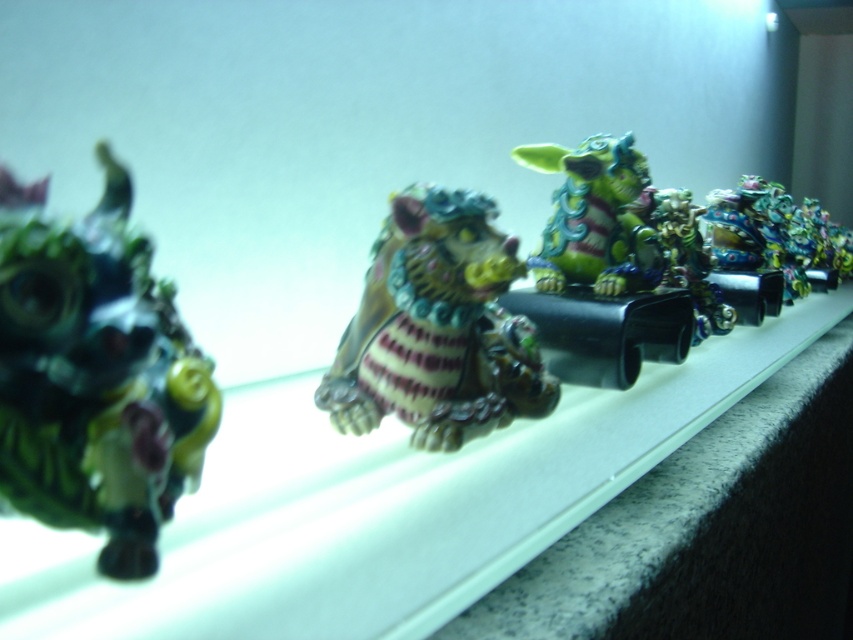
You are an interior designer arranging a shelf. You have a shiny green plastic dragon at left and a metallic gold dragon at center. Which dragon is placed lower on the shelf?

The shiny green plastic dragon at left is placed lower on the shelf because it is located below the metallic gold dragon at center.

You are a collector who wants to place a new figurine between the shiny green plastic dragon at left and the shiny green and purple figurine at center. Based on their heights, which side should you place it closer to for balance?

The shiny green plastic dragon at left is much taller than the shiny green and purple figurine at center, so placing the new figurine closer to the shorter shiny green and purple figurine at center would help balance the display.

You are an art curator examining the shelf of figurines. You notice two points on the shelf marked as point 1 at coordinates (27, 433) and point 2 at coordinates (573, 154). If you were to place a new decorative item on the shelf, which point would be better for visibility from the front of the shelf?

Point 1 at coordinates (27, 433) is closer to the viewer than point 2 at coordinates (573, 154), so placing the new decorative item there would provide better visibility from the front of the shelf.